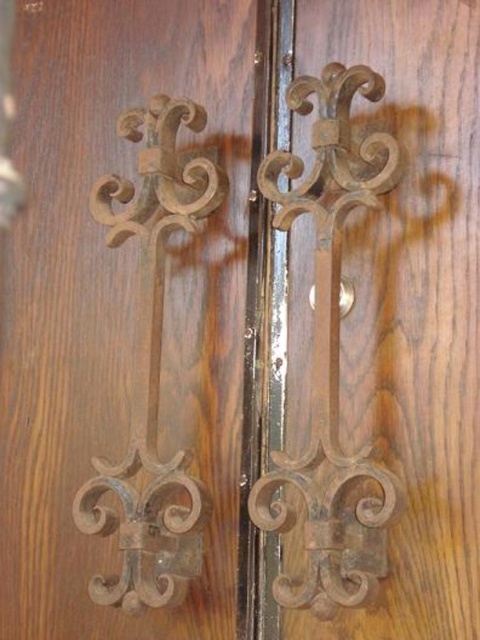
You are trying to open the door and see the rusty metal door handle at center and the brown wrought iron at left. Which handle should you pull to open the door?

The rusty metal door handle at center is positioned on the right side of brown wrought iron at left, so you should pull the brown wrought iron at left since it is on the left side of the door and typically doors open towards the hinges which are usually on the opposite side.

You are a door installer and need to place a new handle exactly where the rusty metal door handle at center is located. What are the coordinates of the spot where you should place the new handle?

The coordinates for the rusty metal door handle at center are at point (328, 349), so you should place the new handle at those coordinates.

You are a painter standing 1.2 meters away from the wooden doors. You see the rusty metal door handle at center. Can you reach it without moving closer?

The rusty metal door handle at center is 1.07 meters from viewer. Since you are standing 1.2 meters away, you are slightly farther than the handle, so you cannot reach it without moving closer.